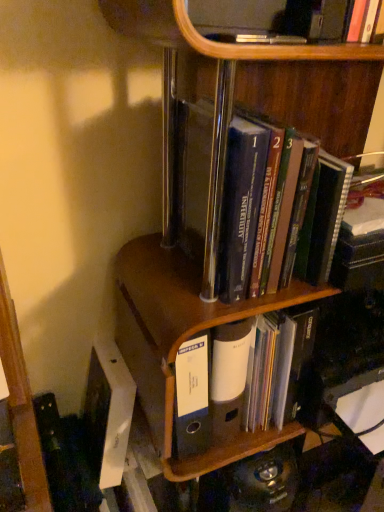
This screenshot has height=512, width=384. I want to click on hardcover books at center, which appears as the second book when ordered from the bottom, so click(305, 212).

Locate an element on the screen. This screenshot has height=512, width=384. white matte file folder at center, the second book positioned from the top is located at coordinates (258, 386).

Considering the relative sizes of white matte file folder at center, the first book positioned from the bottom, and brown wood file at center in the image provided, is white matte file folder at center, the first book positioned from the bottom, bigger than brown wood file at center?

No, white matte file folder at center, the first book positioned from the bottom, is not bigger than brown wood file at center.

Would you say white matte file folder at center, the first book positioned from the bottom, is outside brown wood file at center?

Yes, white matte file folder at center, the first book positioned from the bottom, is outside of brown wood file at center.

Looking at this image, in terms of height, does white matte file folder at center, the first book positioned from the bottom, look taller or shorter compared to brown wood file at center?

Considering their sizes, white matte file folder at center, the first book positioned from the bottom, has less height than brown wood file at center.

Which object is positioned more to the right, white matte file folder at center, the first book positioned from the bottom, or brown wood file at center?

white matte file folder at center, the first book positioned from the bottom.

Does brown wood file at center have a greater width compared to hardcover books at center, the first book in the top-to-bottom sequence?

Yes, brown wood file at center is wider than hardcover books at center, the first book in the top-to-bottom sequence.

Is brown wood file at center placed right next to hardcover books at center, the first book in the top-to-bottom sequence?

No, brown wood file at center is not next to hardcover books at center, the first book in the top-to-bottom sequence.

Does brown wood file at center contain hardcover books at center, which appears as the second book when ordered from the bottom?

No, hardcover books at center, which appears as the second book when ordered from the bottom, is not inside brown wood file at center.

Which object is positioned more to the left, hardcover books at center, the first book in the top-to-bottom sequence, or white matte file folder at center, the first book positioned from the bottom?

hardcover books at center, the first book in the top-to-bottom sequence, is more to the left.

Would you say hardcover books at center, the first book in the top-to-bottom sequence, is inside or outside white matte file folder at center, the second book positioned from the top?

hardcover books at center, the first book in the top-to-bottom sequence, lies outside white matte file folder at center, the second book positioned from the top.

Which point is more distant from viewer, (263, 200) or (251, 352)?

Positioned behind is point (251, 352).

From the image's perspective, relative to white matte file folder at center, the second book positioned from the top, is hardcover books at center, the first book in the top-to-bottom sequence, above or below?

Clearly, from the image's perspective, hardcover books at center, the first book in the top-to-bottom sequence, is above white matte file folder at center, the second book positioned from the top.

From a real-world perspective, which is physically below, hardcover books at center, the first book in the top-to-bottom sequence, or brown wood file at center?

brown wood file at center is physically lower.

Between hardcover books at center, which appears as the second book when ordered from the bottom, and brown wood file at center, which one has smaller width?

hardcover books at center, which appears as the second book when ordered from the bottom.

Is brown wood file at center taller than white matte file folder at center, the first book positioned from the bottom?

Answer: Yes, brown wood file at center is taller than white matte file folder at center, the first book positioned from the bottom.

Which is nearer, (172, 407) or (302, 313)?

Point (172, 407).

Considering the positions of objects brown wood file at center and white matte file folder at center, the second book positioned from the top, in the image provided, who is more to the left, brown wood file at center or white matte file folder at center, the second book positioned from the top,?

brown wood file at center is more to the left.

From a real-world perspective, between brown wood file at center and white matte file folder at center, the second book positioned from the top, who is vertically higher?

brown wood file at center.

From a real-world perspective, which object rests below the other?

white matte file folder at center, the second book positioned from the top, from a real-world perspective.

Is there a large distance between white matte file folder at center, the second book positioned from the top, and hardcover books at center, the first book in the top-to-bottom sequence?

They are positioned close to each other.

Where is `book on the left side of white matte file folder at center, the first book positioned from the bottom`? The image size is (384, 512). book on the left side of white matte file folder at center, the first book positioned from the bottom is located at coordinates (305, 212).

Is hardcover books at center, which appears as the second book when ordered from the bottom, at the back of white matte file folder at center, the first book positioned from the bottom?

white matte file folder at center, the first book positioned from the bottom, is not turned away from hardcover books at center, which appears as the second book when ordered from the bottom.

In order to click on book behind the brown wood file at center in this screenshot , I will do `click(258, 386)`.

The height and width of the screenshot is (512, 384). What are the coordinates of `book above the brown wood file at center (from a real-world perspective)` in the screenshot? It's located at (305, 212).

When comparing their distances from brown wood file at center, does hardcover books at center, the first book in the top-to-bottom sequence, or white matte file folder at center, the first book positioned from the bottom, seem further?

Based on the image, hardcover books at center, the first book in the top-to-bottom sequence, appears to be further to brown wood file at center.

Which object lies nearer to the anchor point brown wood file at center, white matte file folder at center, the first book positioned from the bottom, or hardcover books at center, the first book in the top-to-bottom sequence?

white matte file folder at center, the first book positioned from the bottom.

Looking at the image, which one is located closer to white matte file folder at center, the second book positioned from the top, hardcover books at center, the first book in the top-to-bottom sequence, or brown wood file at center?

brown wood file at center.

Considering their positions, is brown wood file at center positioned further to hardcover books at center, the first book in the top-to-bottom sequence, than white matte file folder at center, the first book positioned from the bottom?

The object further to hardcover books at center, the first book in the top-to-bottom sequence, is white matte file folder at center, the first book positioned from the bottom.

When comparing their distances from white matte file folder at center, the first book positioned from the bottom, does brown wood file at center or hardcover books at center, which appears as the second book when ordered from the bottom, seem further?

hardcover books at center, which appears as the second book when ordered from the bottom, is further to white matte file folder at center, the first book positioned from the bottom.

Consider the image. Which object lies further to the anchor point hardcover books at center, which appears as the second book when ordered from the bottom, white matte file folder at center, the second book positioned from the top, or brown wood file at center?

white matte file folder at center, the second book positioned from the top, is positioned further to the anchor hardcover books at center, which appears as the second book when ordered from the bottom.

The width and height of the screenshot is (384, 512). I want to click on shelf that lies between hardcover books at center, the first book in the top-to-bottom sequence, and white matte file folder at center, the first book positioned from the bottom, from top to bottom, so click(x=178, y=348).